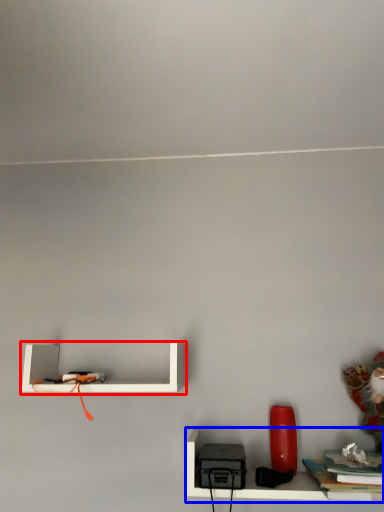
Question: Which object appears closest to the camera in this image, shelf (highlighted by a red box) or shelf (highlighted by a blue box)?

Choices:
 (A) shelf
 (B) shelf

Answer: (B)